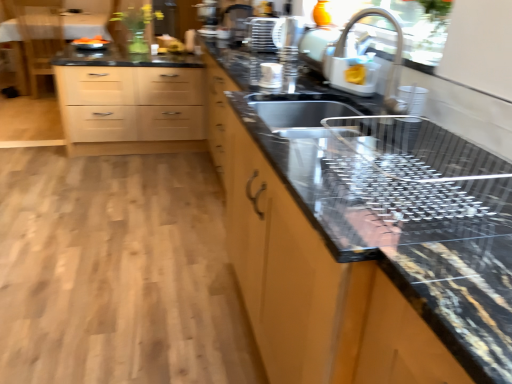
Locate an element on the screen. The height and width of the screenshot is (384, 512). free space in front of light wood/finish chest of drawers at upper left is located at coordinates (99, 176).